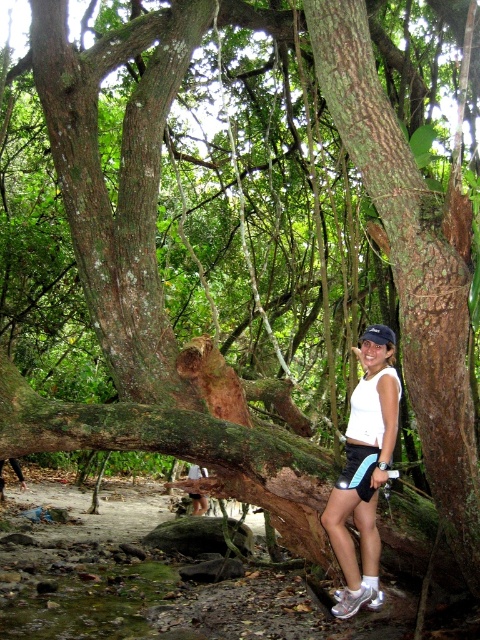
Is point (432, 324) in front of point (374, 493)?

Yes, it is in front of point (374, 493).

Identify the location of brown rough tree trunk at center. (408, 268).

Between point (457, 365) and point (355, 416), which one is positioned in front?

Point (457, 365) is in front.

This screenshot has width=480, height=640. What are the coordinates of `brown rough tree trunk at center` in the screenshot? It's located at (408, 268).